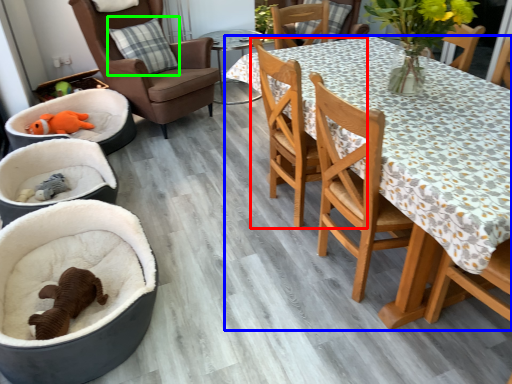
Question: Which object is positioned farthest from chair (highlighted by a red box)? Select from desk (highlighted by a blue box) and pillow (highlighted by a green box).

Choices:
 (A) desk
 (B) pillow

Answer: (B)